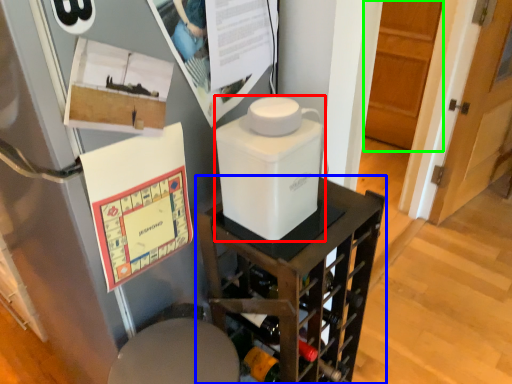
Question: Which is nearer to the appliance (highlighted by a red box)? furniture (highlighted by a blue box) or door (highlighted by a green box).

Choices:
 (A) furniture
 (B) door

Answer: (A)